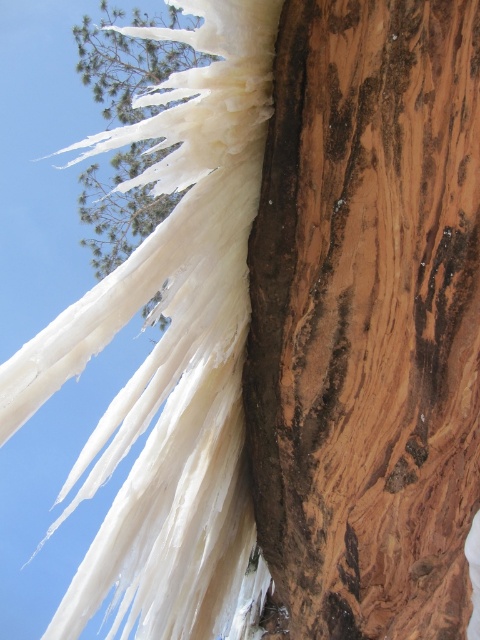
Who is positioned more to the right, brown wood at center or white frosty tree at upper left?

From the viewer's perspective, brown wood at center appears more on the right side.

Between point (412, 465) and point (96, 64), which one is positioned behind?

Positioned behind is point (96, 64).

Describe the element at coordinates (368, 317) in the screenshot. I see `brown wood at center` at that location.

The image size is (480, 640). In order to click on brown wood at center in this screenshot , I will do `click(368, 317)`.